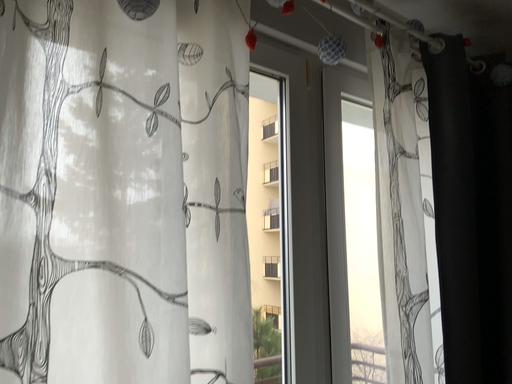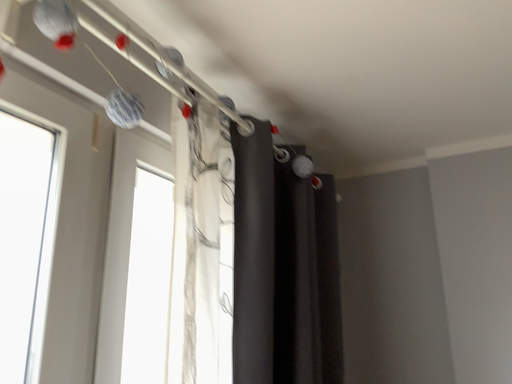
Question: Which way did the camera rotate in the video?

Choices:
 (A) rotated right
 (B) rotated left

Answer: (A)